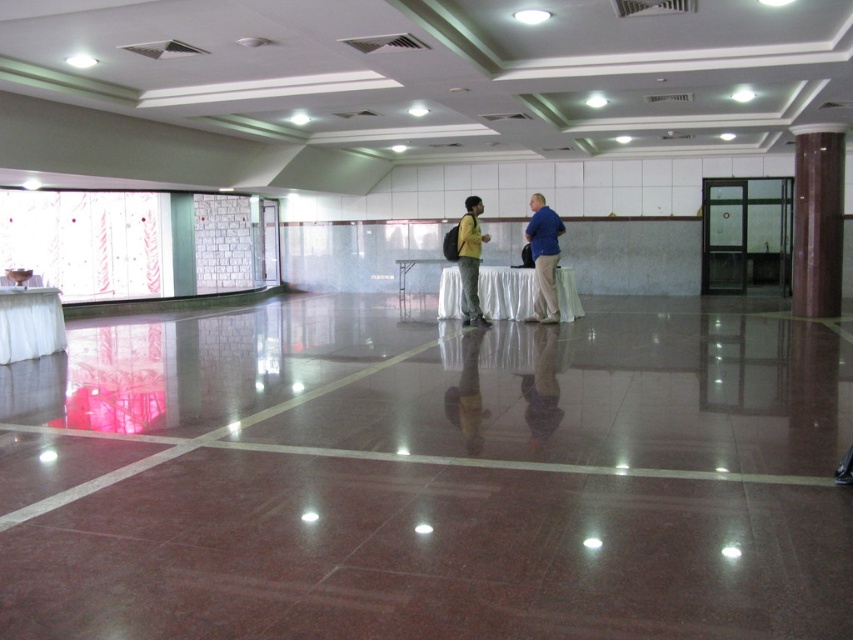
Question: Estimate the real-world distances between objects in this image. Which object is farther from the matte yellow shirt at center?

Choices:
 (A) white cloth table at left
 (B) brown polished column at right

Answer: (B)

Question: Is brown polished column at right smaller than matte yellow shirt at center?

Choices:
 (A) yes
 (B) no

Answer: (B)

Question: Which of the following is the closest to the observer?

Choices:
 (A) white cloth-covered table at center
 (B) matte yellow shirt at center
 (C) brown polished column at right

Answer: (B)

Question: Can you confirm if matte yellow shirt at center is thinner than white glossy table at center?

Choices:
 (A) no
 (B) yes

Answer: (B)

Question: Which point is closer to the camera taking this photo?

Choices:
 (A) (456, 266)
 (B) (3, 291)

Answer: (B)

Question: From the image, what is the correct spatial relationship of brown polished column at right in relation to blue fabric shirt at center?

Choices:
 (A) right
 (B) left

Answer: (A)